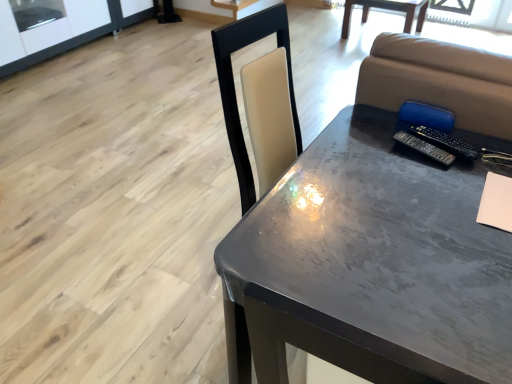
Where is `vacant area that lies between black plastic remote at right, which appears as the first remote when viewed from the left, and beige matte notebook at lower right`? vacant area that lies between black plastic remote at right, which appears as the first remote when viewed from the left, and beige matte notebook at lower right is located at coordinates tap(453, 183).